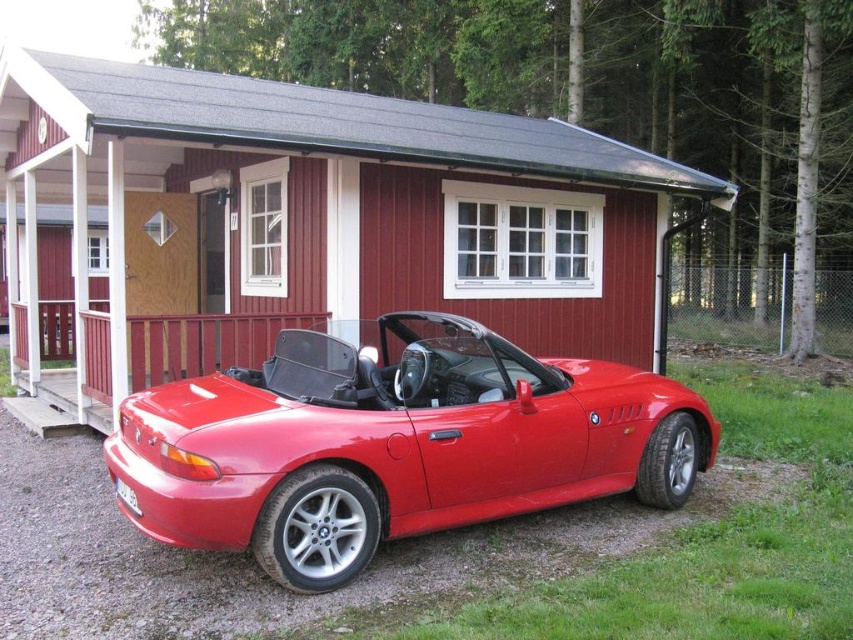
You are a delivery person trying to park your van next to the wooden cabin. You see the shiny red convertible at center and the wooden railing at lower left. Which object is bigger in size?

The shiny red convertible at center is larger in size than the wooden railing at lower left, so the shiny red convertible at center is bigger.

You are a delivery person trying to park your van behind the shiny red convertible at center. The wooden railing at lower left is blocking the path. Can you drive around the railing to park behind the car?

The shiny red convertible at center is positioned under the wooden railing at lower left, so the railing is above the car. To park behind the car, you would need to drive around the railing, but since the railing is part of the cabin structure, it might not be possible to drive around it without damaging the railing or the car. Consider an alternative parking spot.